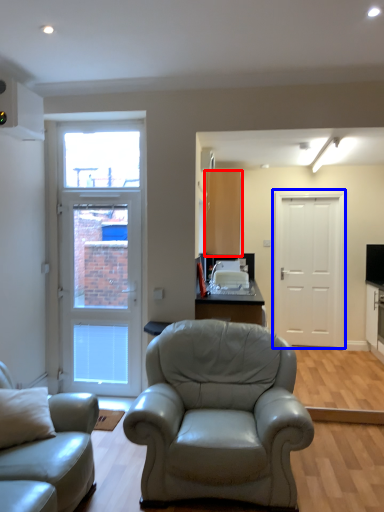
Question: Which object is further to the camera taking this photo, cabinetry (highlighted by a red box) or door (highlighted by a blue box)?

Choices:
 (A) cabinetry
 (B) door

Answer: (B)